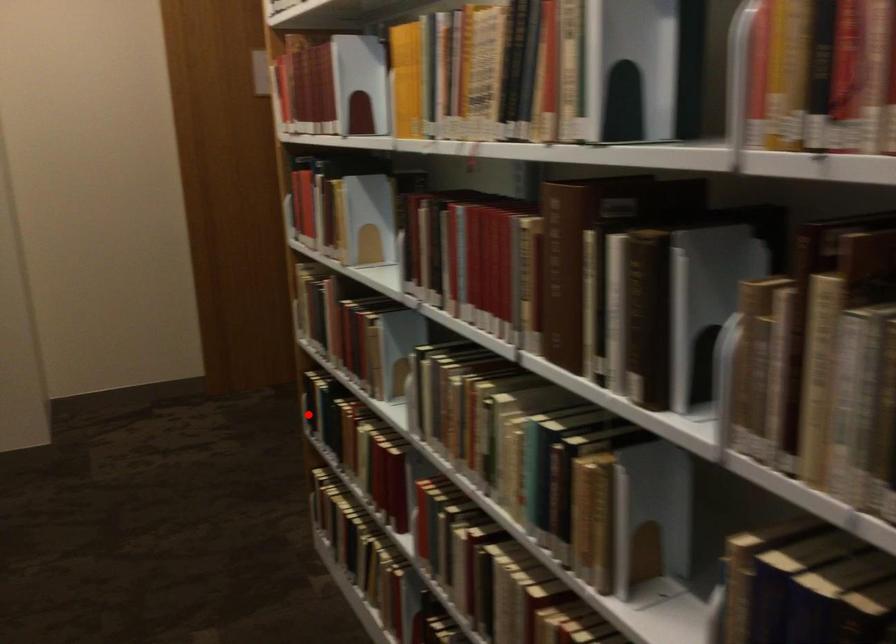
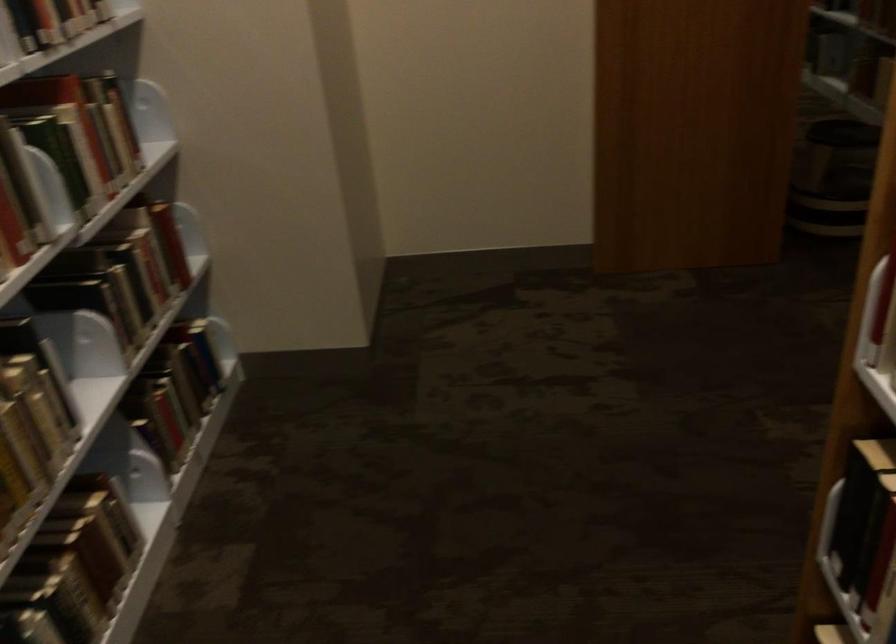
Question: I am providing you with two images of the same scene from different viewpoints. A red point is marked on the first image. Can you still see the location of the red point in image 2?

Choices:
 (A) Yes
 (B) No

Answer: (A)